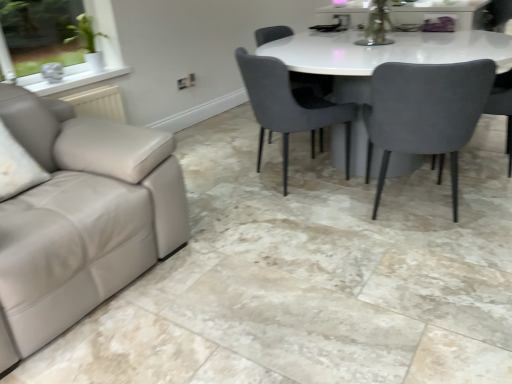
Question: From the image's perspective, is velvet grey chair at right, which ranks as the 1th chair in right-to-left order, below velvet grey chair at center, which is the 1th chair from left to right?

Choices:
 (A) yes
 (B) no

Answer: (B)

Question: Is velvet grey chair at right, which ranks as the 1th chair in right-to-left order, taller than velvet grey chair at center, which appears as the 4th chair when viewed from the right?

Choices:
 (A) yes
 (B) no

Answer: (B)

Question: Could velvet grey chair at center, which is the 1th chair from left to right, be considered to be inside velvet grey chair at right, acting as the 4th chair starting from the left?

Choices:
 (A) no
 (B) yes

Answer: (A)

Question: Can you confirm if velvet grey chair at right, acting as the 4th chair starting from the left, is shorter than velvet grey chair at center, which is the 1th chair from left to right?

Choices:
 (A) yes
 (B) no

Answer: (A)

Question: Is velvet grey chair at right, acting as the 4th chair starting from the left, bigger than velvet grey chair at center, which is the 1th chair from left to right?

Choices:
 (A) no
 (B) yes

Answer: (A)

Question: Is velvet grey chair at right, which ranks as the 1th chair in right-to-left order, to the left of velvet grey chair at center, which is the 1th chair from left to right, from the viewer's perspective?

Choices:
 (A) yes
 (B) no

Answer: (B)

Question: Is suede gray chair at right, arranged as the third chair when viewed from the left, aimed at velvet grey chair at center, which appears as the 4th chair when viewed from the right?

Choices:
 (A) yes
 (B) no

Answer: (B)

Question: Does suede gray chair at right, arranged as the third chair when viewed from the left, have a greater width compared to velvet grey chair at center, which appears as the 4th chair when viewed from the right?

Choices:
 (A) yes
 (B) no

Answer: (A)

Question: Is suede gray chair at right, arranged as the third chair when viewed from the left, far away from velvet grey chair at center, which appears as the 4th chair when viewed from the right?

Choices:
 (A) yes
 (B) no

Answer: (B)

Question: Is suede gray chair at right, marked as the 2th chair in a right-to-left arrangement, shorter than velvet grey chair at center, which is the 1th chair from left to right?

Choices:
 (A) yes
 (B) no

Answer: (B)

Question: Can you confirm if suede gray chair at right, marked as the 2th chair in a right-to-left arrangement, is bigger than velvet grey chair at center, which appears as the 4th chair when viewed from the right?

Choices:
 (A) yes
 (B) no

Answer: (A)

Question: Does suede gray chair at right, marked as the 2th chair in a right-to-left arrangement, have a greater height compared to velvet grey chair at center, which is the 1th chair from left to right?

Choices:
 (A) no
 (B) yes

Answer: (B)

Question: Is velvet grey chair at center, which appears as the 4th chair when viewed from the right, surrounding velvet grey chair at right, acting as the 4th chair starting from the left?

Choices:
 (A) yes
 (B) no

Answer: (B)